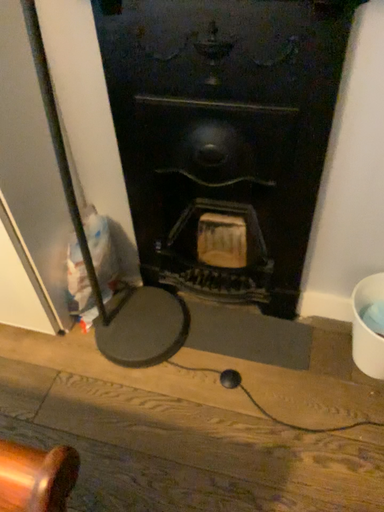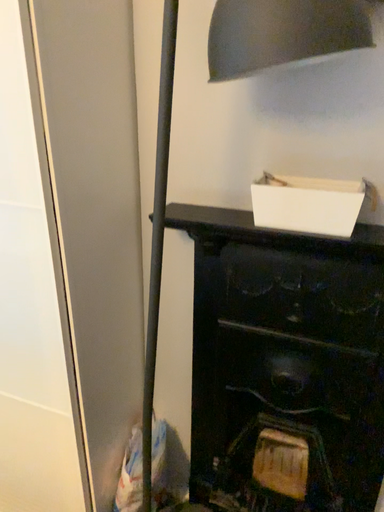
Question: How did the camera likely rotate when shooting the video?

Choices:
 (A) rotated downward
 (B) rotated upward

Answer: (B)